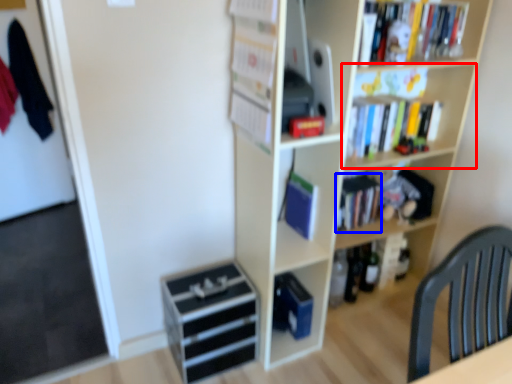
Question: Among these objects, which one is farthest to the camera, shelf (highlighted by a red box) or book (highlighted by a blue box)?

Choices:
 (A) shelf
 (B) book

Answer: (B)